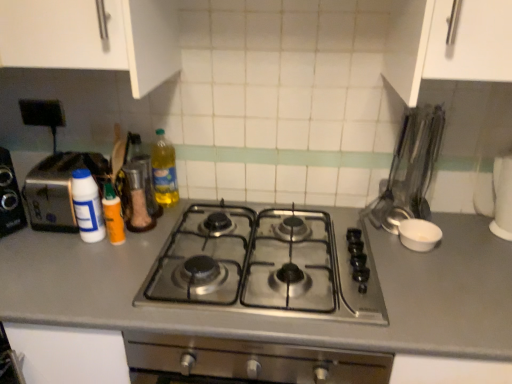
The height and width of the screenshot is (384, 512). I want to click on blank space to the left of white matte bowl at right, the first appliance ordered from the bottom, so click(380, 241).